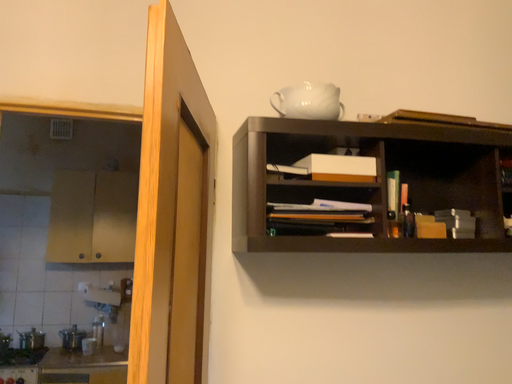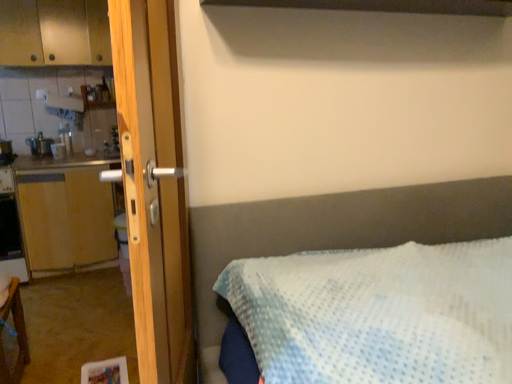
Question: Which way did the camera rotate in the video?

Choices:
 (A) rotated downward
 (B) rotated upward

Answer: (A)